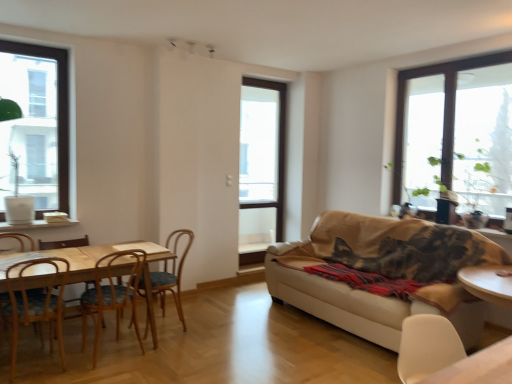
Question: Should I look upward or downward to see transparent glass window at upper right, which ranks as the 3th window in left-to-right order?

Choices:
 (A) down
 (B) up

Answer: (B)

Question: Considering the relative sizes of white matte chair at lower right, which is the first chair from front to back, and wooden chair at left, positioned as the fourth chair in back-to-front order, in the image provided, is white matte chair at lower right, which is the first chair from front to back, smaller than wooden chair at left, positioned as the fourth chair in back-to-front order,?

Choices:
 (A) yes
 (B) no

Answer: (A)

Question: Does white matte chair at lower right, which is the fifth chair in back-to-front order, have a lesser height compared to wooden chair at left, the second chair positioned from the front?

Choices:
 (A) no
 (B) yes

Answer: (B)

Question: Is white matte chair at lower right, which is the fifth chair in back-to-front order, with wooden chair at left, positioned as the fourth chair in back-to-front order?

Choices:
 (A) yes
 (B) no

Answer: (B)

Question: Is the depth of white matte chair at lower right, which is the first chair from front to back, greater than that of wooden chair at left, placed as the fourth chair when sorted from right to left?

Choices:
 (A) no
 (B) yes

Answer: (A)

Question: From the image's perspective, is white matte chair at lower right, which is the fifth chair in left-to-right order, located beneath wooden chair at left, positioned as the fourth chair in back-to-front order?

Choices:
 (A) yes
 (B) no

Answer: (B)

Question: Does white matte chair at lower right, which is the first chair from front to back, appear on the right side of wooden chair at left, which ranks as the second chair in left-to-right order?

Choices:
 (A) no
 (B) yes

Answer: (B)

Question: Can you confirm if green leafy plant at right is positioned to the left of wooden chair at left, which ranks as the second chair in left-to-right order?

Choices:
 (A) yes
 (B) no

Answer: (B)

Question: Is green leafy plant at right further to camera compared to wooden chair at left, placed as the fourth chair when sorted from right to left?

Choices:
 (A) no
 (B) yes

Answer: (B)

Question: Is green leafy plant at right at the right side of wooden chair at left, the second chair positioned from the front?

Choices:
 (A) yes
 (B) no

Answer: (A)

Question: Is green leafy plant at right looking in the opposite direction of wooden chair at left, the second chair positioned from the front?

Choices:
 (A) yes
 (B) no

Answer: (B)

Question: Considering the relative sizes of green leafy plant at right and wooden chair at left, placed as the fourth chair when sorted from right to left, in the image provided, is green leafy plant at right bigger than wooden chair at left, placed as the fourth chair when sorted from right to left,?

Choices:
 (A) no
 (B) yes

Answer: (B)

Question: Is green leafy plant at right smaller than wooden chair at left, the second chair positioned from the front?

Choices:
 (A) yes
 (B) no

Answer: (B)

Question: Considering the relative sizes of wooden table at left and clear glass window at center, the 1th window in the back-to-front sequence, in the image provided, is wooden table at left wider than clear glass window at center, the 1th window in the back-to-front sequence,?

Choices:
 (A) yes
 (B) no

Answer: (A)